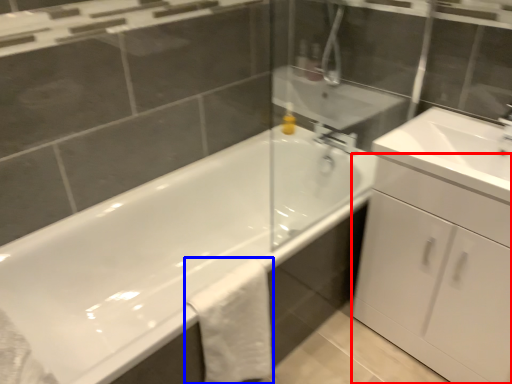
Question: Which of the following is the closest to the observer, cabinetry (highlighted by a red box) or bath towel (highlighted by a blue box)?

Choices:
 (A) cabinetry
 (B) bath towel

Answer: (A)